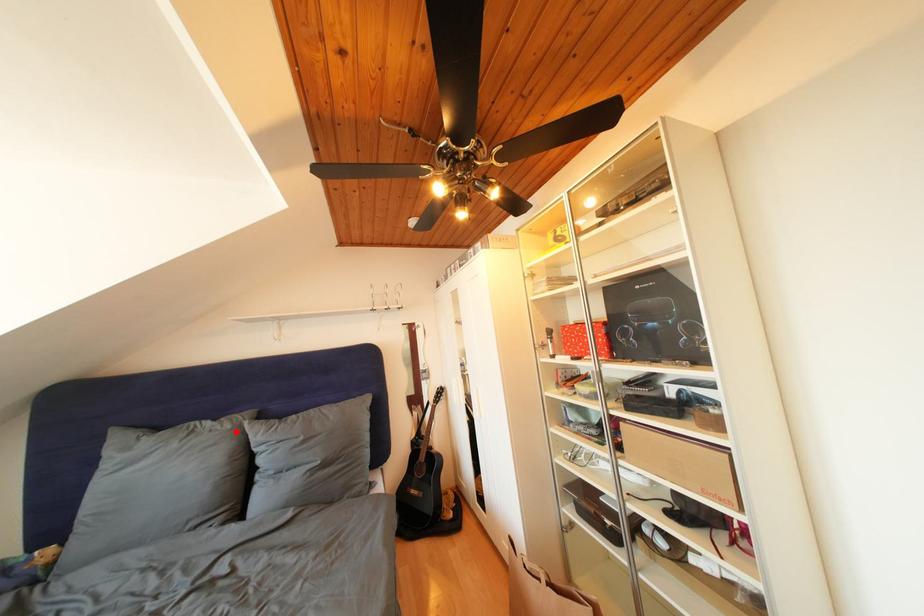
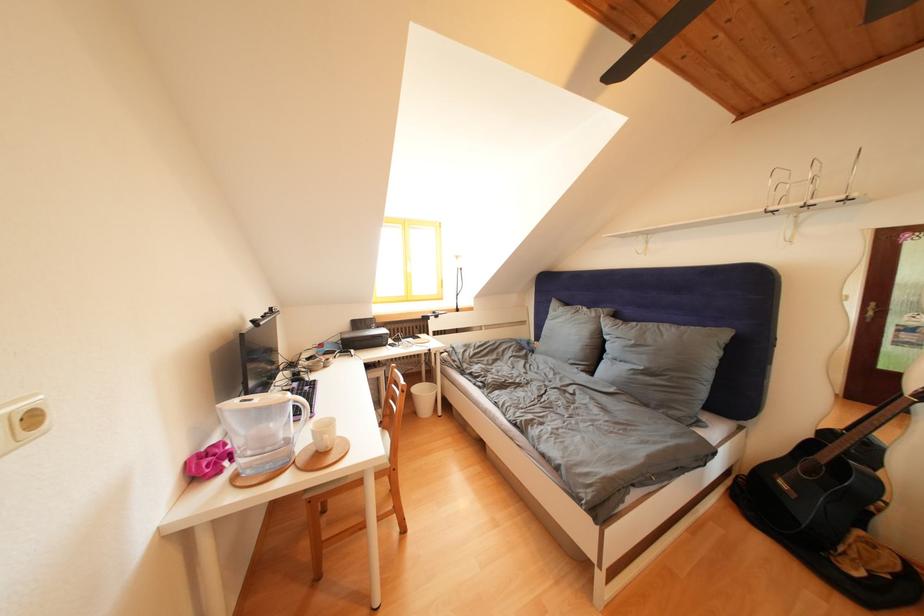
Where in the second image is the point corresponding to the highlighted location from the first image?

(602, 320)